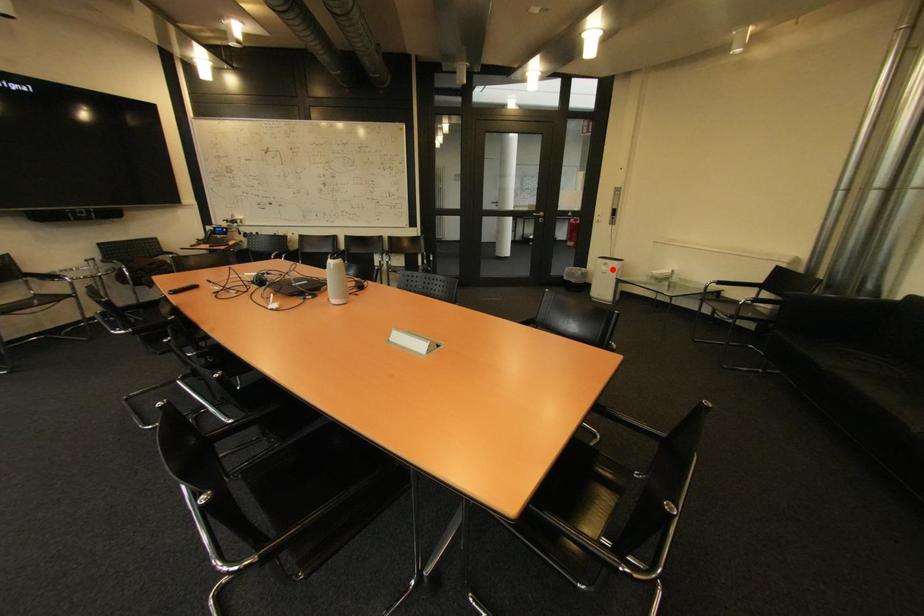
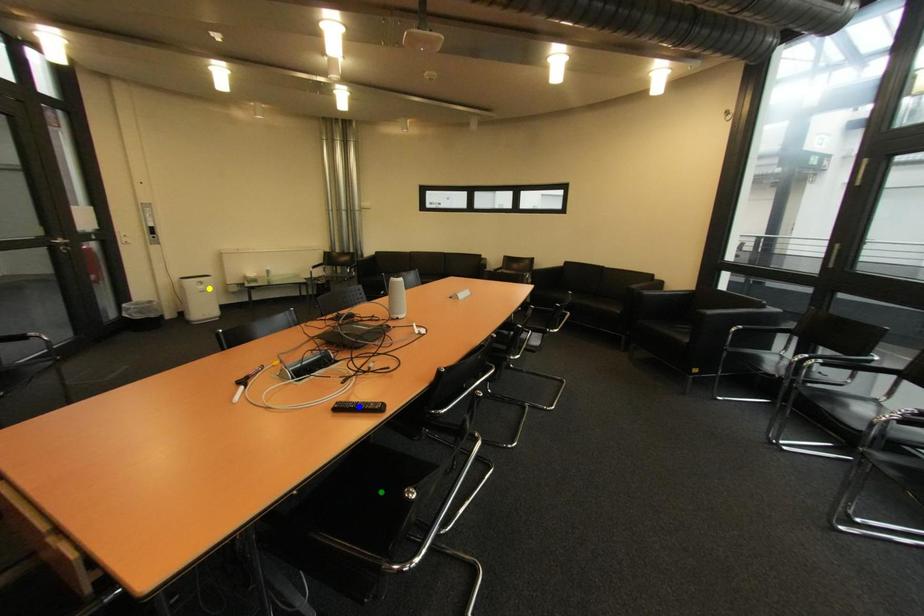
Question: I am providing you with two images of the same scene from different viewpoints. A red point is marked on the first image. You are given multiple points on the second image. Which mark in image 2 goes with the point in image 1?

Choices:
 (A) blue point
 (B) green point
 (C) yellow point

Answer: (C)